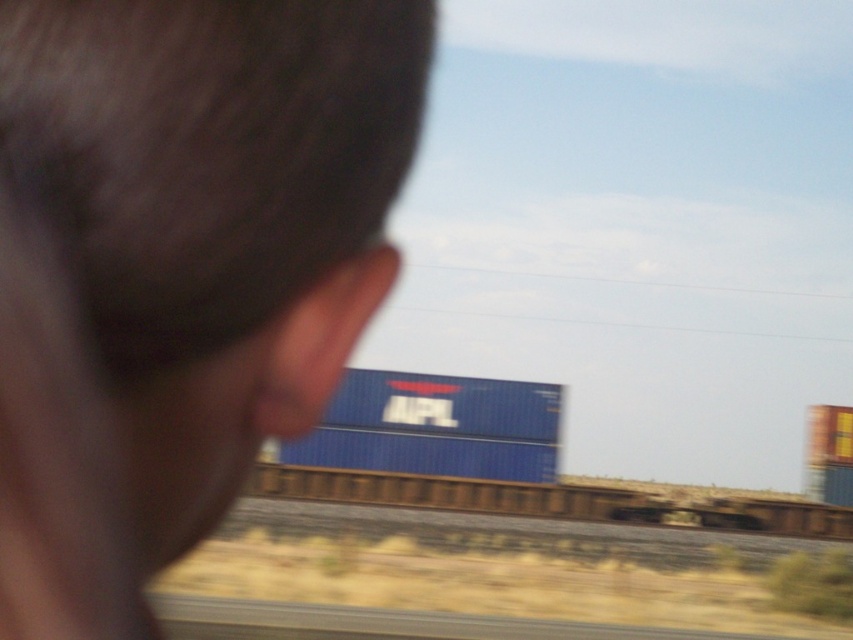
You are a photographer trying to capture a photo of the blue matte container at center and the blue matte train car at center through the train window. Since the window is slightly dirty, you need to focus on the wider object to get a clearer image. Which object should you focus on?

The blue matte train car at center has a greater width than the blue matte container at center, so you should focus on the blue matte train car at center to get a clearer image.